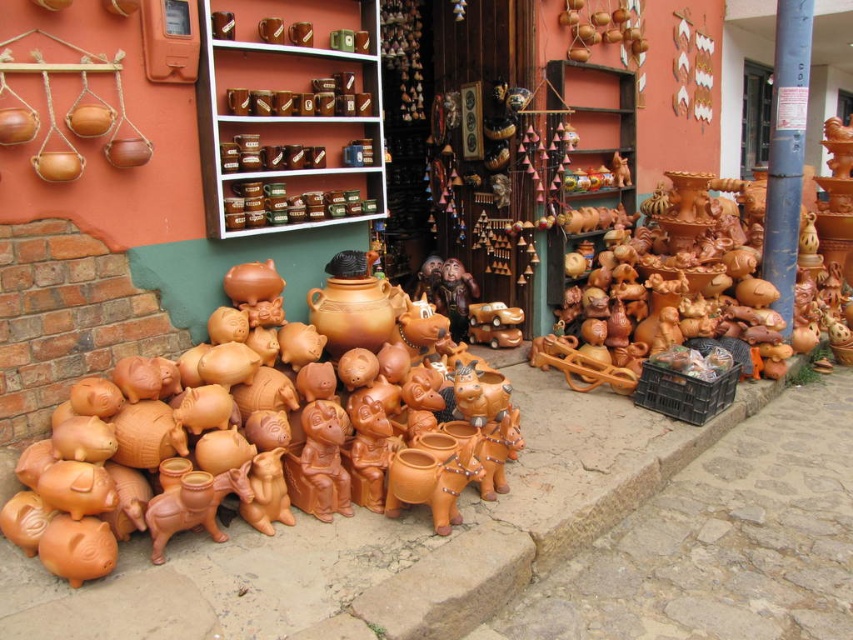
Question: Which point is closer to the camera taking this photo?

Choices:
 (A) (270, 381)
 (B) (331, 81)
 (C) (287, 54)

Answer: (A)

Question: Is matte ceramic mugs at upper center thinner than blue painted wood pole at upper right?

Choices:
 (A) no
 (B) yes

Answer: (A)

Question: Estimate the real-world distances between objects in this image. Which object is farther from the matte brown boxes at upper center?

Choices:
 (A) terracotta clay piggy banks at center
 (B) matte ceramic mugs at upper center

Answer: (A)

Question: Does terracotta clay piggy banks at center appear on the left side of matte ceramic mugs at upper center?

Choices:
 (A) yes
 (B) no

Answer: (A)

Question: Which point is farther to the camera?

Choices:
 (A) (267, 113)
 (B) (254, 109)

Answer: (A)

Question: Observing the image, what is the correct spatial positioning of matte ceramic mugs at upper center in reference to matte brown boxes at upper center?

Choices:
 (A) right
 (B) left

Answer: (A)